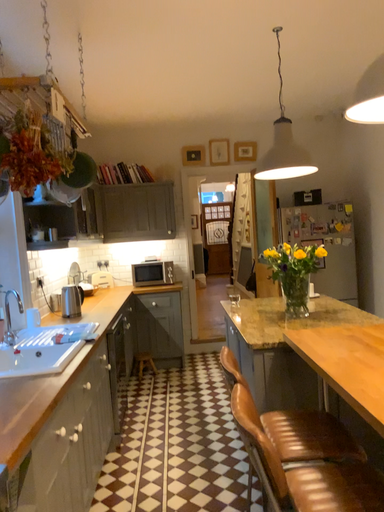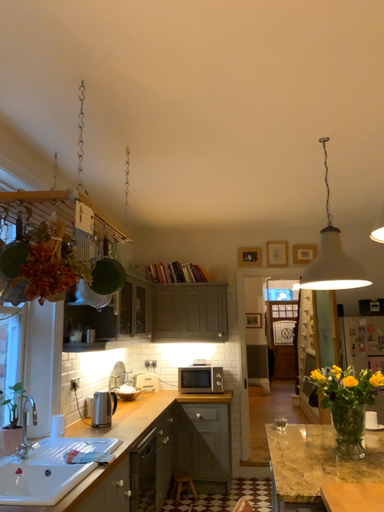
Question: Which way did the camera rotate in the video?

Choices:
 (A) rotated left
 (B) rotated right

Answer: (A)